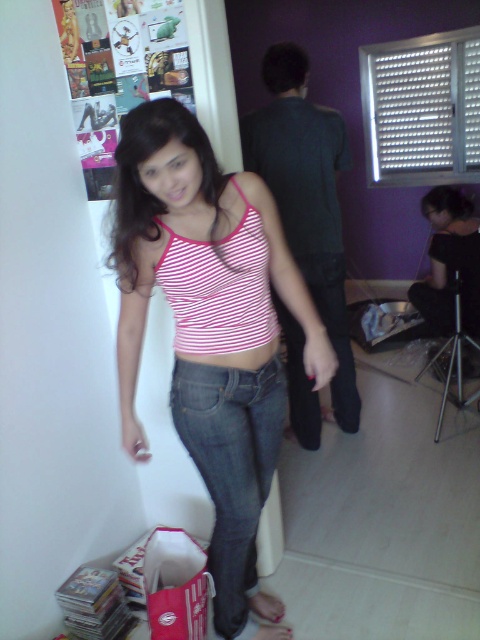
You are standing in the living room and want to place a small plant between the two points marked as point (206, 180) and point (266, 429). According to the coordinates provided, which point should the plant be closer to?

The plant should be placed closer to point (206, 180) because it is in front of point (266, 429), so the midpoint would be closer to the front point.

You are organizing a clothing donation drive and need to sort items by type. You see the denim jeans at lower center and the denim at center. Which one should you place in the pants section?

The denim jeans at lower center should be placed in the pants section because it is a pair of jeans, while the denim at center might refer to another denim item like a jacket or shorts.

Looking at the woman in the image, which item of clothing is larger in size between the pink striped tank top at center and the denim at center?

The pink striped tank top at center is bigger than the denim at center.